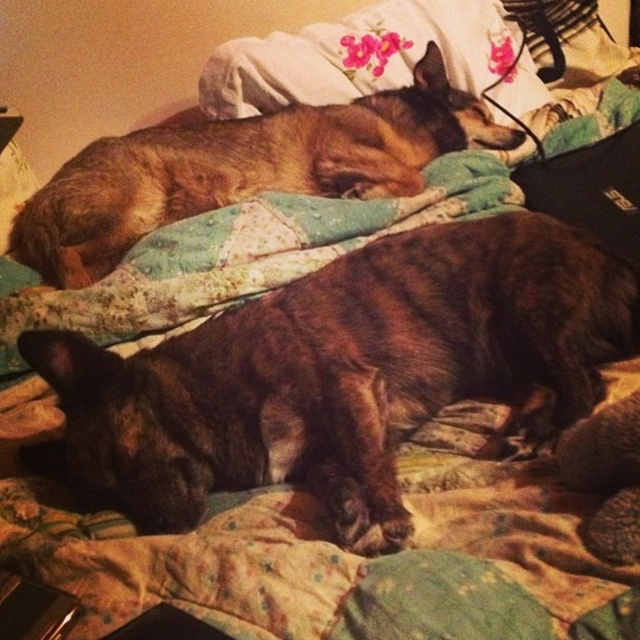
Question: Among these objects, which one is nearest to the camera?

Choices:
 (A) brown fur dog at upper left
 (B) brown fur dog at center
 (C) fluffy white pillow at upper center

Answer: (B)

Question: Which of the following is the farthest from the observer?

Choices:
 (A) [x=150, y=256]
 (B) [x=160, y=188]

Answer: (B)

Question: Can you confirm if brown fur dog at upper left is bigger than fluffy quilt at center?

Choices:
 (A) no
 (B) yes

Answer: (B)

Question: Is brown fur dog at center positioned in front of fluffy quilt at center?

Choices:
 (A) yes
 (B) no

Answer: (A)

Question: Can you confirm if brown fur dog at upper left is thinner than fluffy quilt at center?

Choices:
 (A) no
 (B) yes

Answer: (A)

Question: Estimate the real-world distances between objects in this image. Which object is farther from the brown fur dog at center?

Choices:
 (A) fluffy quilt at center
 (B) fluffy white pillow at upper center

Answer: (B)